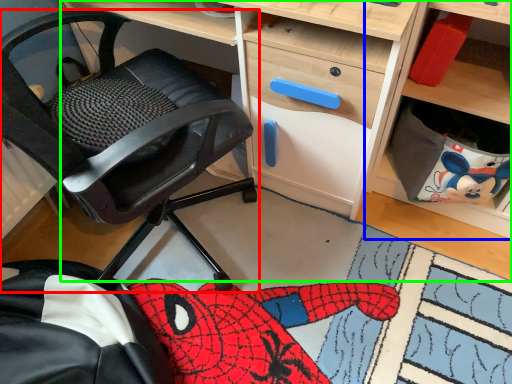
Question: Which object is positioned farthest from chair (highlighted by a red box)? Select from shelf (highlighted by a blue box) and desk (highlighted by a green box).

Choices:
 (A) shelf
 (B) desk

Answer: (B)